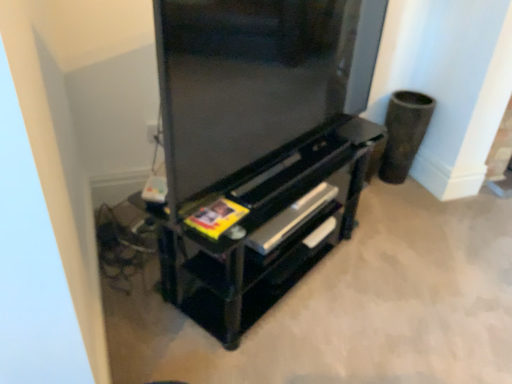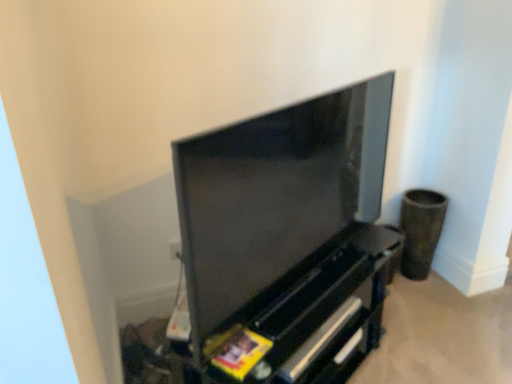
Question: Which way did the camera rotate in the video?

Choices:
 (A) rotated downward
 (B) rotated upward

Answer: (B)